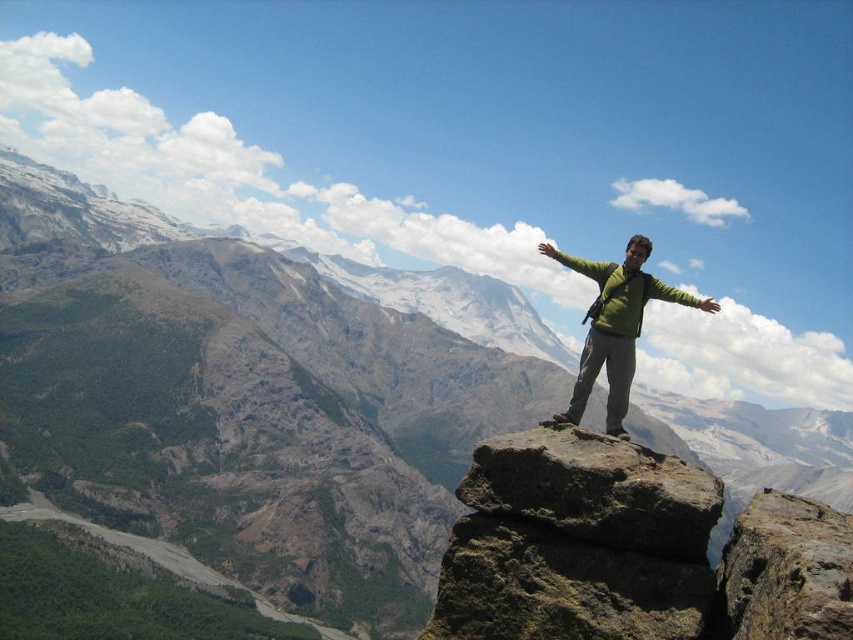
Question: Can you confirm if rusty brown rock at center is wider than brown rough rock at center?

Choices:
 (A) yes
 (B) no

Answer: (B)

Question: Which of the following is the farthest from the observer?

Choices:
 (A) (543, 253)
 (B) (602, 310)
 (C) (718, 481)

Answer: (A)

Question: Is brown rough rock at center closer to camera compared to green matte jacket at center?

Choices:
 (A) yes
 (B) no

Answer: (A)

Question: Estimate the real-world distances between objects in this image. Which object is closer to the rusty rock at center?

Choices:
 (A) green matte jacket at center
 (B) rusty brown rock at center
 (C) green matte hand at upper center
 (D) brown rough rock at center

Answer: (D)

Question: Observing the image, what is the correct spatial positioning of green matte shirt at center in reference to green matte jacket at center?

Choices:
 (A) right
 (B) left

Answer: (A)

Question: Which of the following is the closest to the observer?

Choices:
 (A) (704, 304)
 (B) (550, 253)
 (C) (616, 304)
 (D) (636, 288)

Answer: (C)